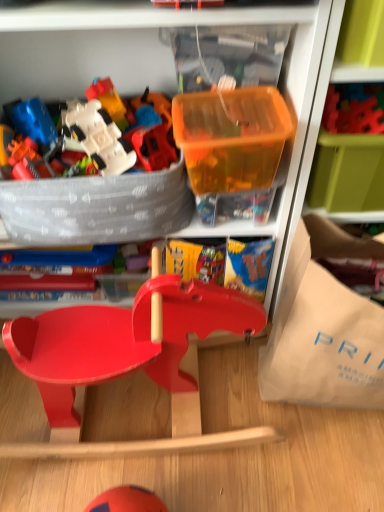
Question: In terms of width, does smooth red wooden baby carriage at center look wider or thinner when compared to beige paper bag at right?

Choices:
 (A) wide
 (B) thin

Answer: (B)

Question: Would you say smooth red wooden baby carriage at center is inside or outside beige paper bag at right?

Choices:
 (A) inside
 (B) outside

Answer: (B)

Question: Estimate the real-world distances between objects in this image. Which object is farther from the beige paper bag at right?

Choices:
 (A) smooth red wooden baby carriage at center
 (B) translucent orange plastic container at upper center
 (C) translucent plastic container at upper right
 (D) white plastic spaceship at upper left, the 1th toy from the left
 (E) smooth plastic toy at center, which is the 1th toy from right to left

Answer: (E)

Question: Which is farther from the translucent orange plastic container at upper center?

Choices:
 (A) white plastic spaceship at upper left, the 1th toy from the left
 (B) smooth red wooden baby carriage at center
 (C) translucent plastic container at upper right
 (D) smooth plastic toy at center, acting as the 1th toy starting from the top
 (E) beige paper bag at right

Answer: (B)